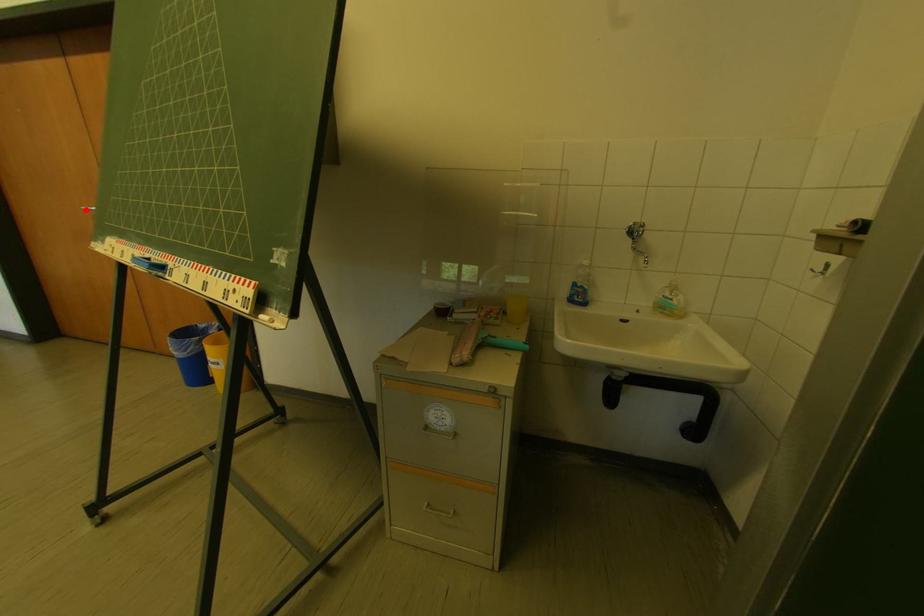
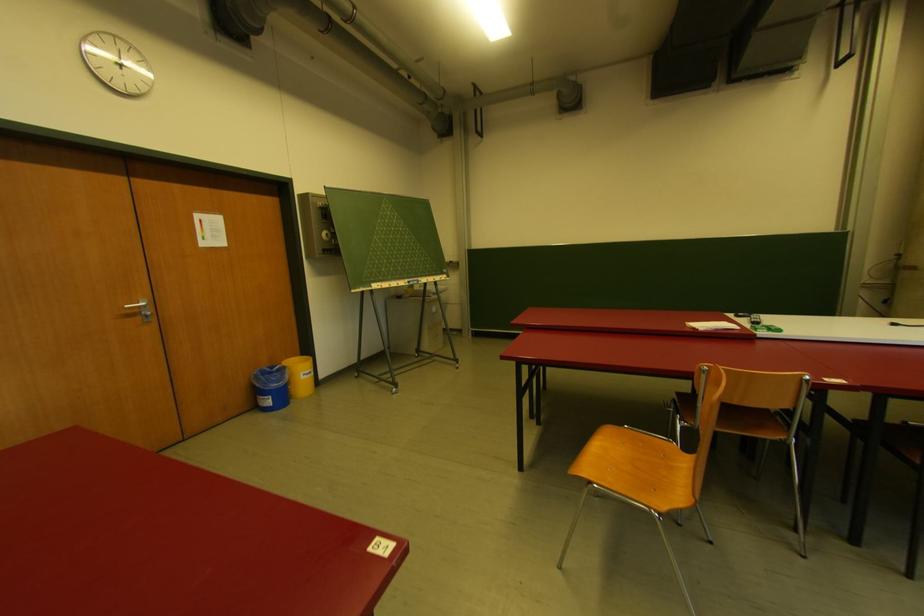
The point at the highlighted location is marked in the first image. Where is the corresponding point in the second image?

(128, 309)